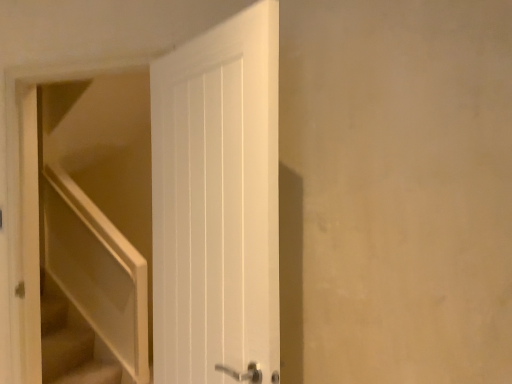
Question: Looking at their shapes, would you say beige carpeted stairs at lower left is wider or thinner than white matte door at left?

Choices:
 (A) wide
 (B) thin

Answer: (A)

Question: Is beige carpeted stairs at lower left bigger or smaller than white matte door at left?

Choices:
 (A) small
 (B) big

Answer: (A)

Question: Does point (113, 365) appear closer or farther from the camera than point (116, 352)?

Choices:
 (A) farther
 (B) closer

Answer: (B)

Question: Is white matte door at left bigger or smaller than beige carpeted stairs at lower left?

Choices:
 (A) big
 (B) small

Answer: (A)

Question: Is white matte door at left to the left or to the right of beige carpeted stairs at lower left in the image?

Choices:
 (A) left
 (B) right

Answer: (B)

Question: Looking at their shapes, would you say white matte door at left is wider or thinner than beige carpeted stairs at lower left?

Choices:
 (A) thin
 (B) wide

Answer: (A)

Question: From a real-world perspective, is white matte door at left physically located above or below beige carpeted stairs at lower left?

Choices:
 (A) below
 (B) above

Answer: (B)